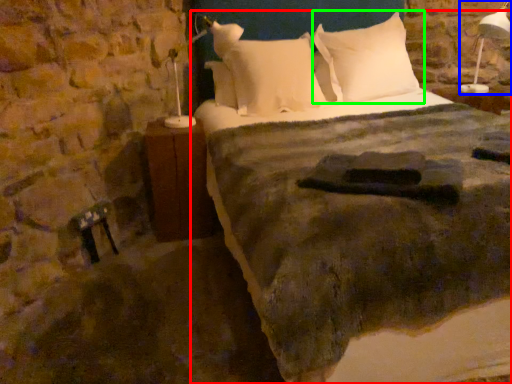
Question: Based on their relative distances, which object is farther from bed (highlighted by a red box)? Choose from bedside lamp (highlighted by a blue box) and pillow (highlighted by a green box).

Choices:
 (A) bedside lamp
 (B) pillow

Answer: (A)